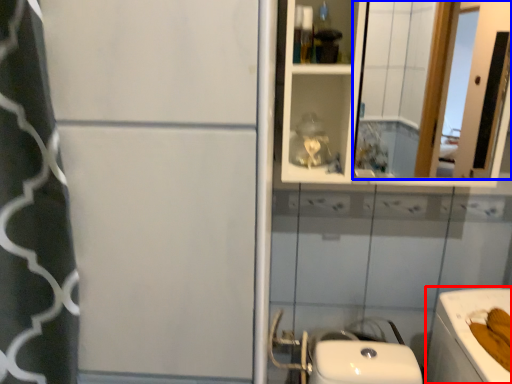
Question: Among these objects, which one is farthest to the camera, bath (highlighted by a red box) or mirror (highlighted by a blue box)?

Choices:
 (A) bath
 (B) mirror

Answer: (B)